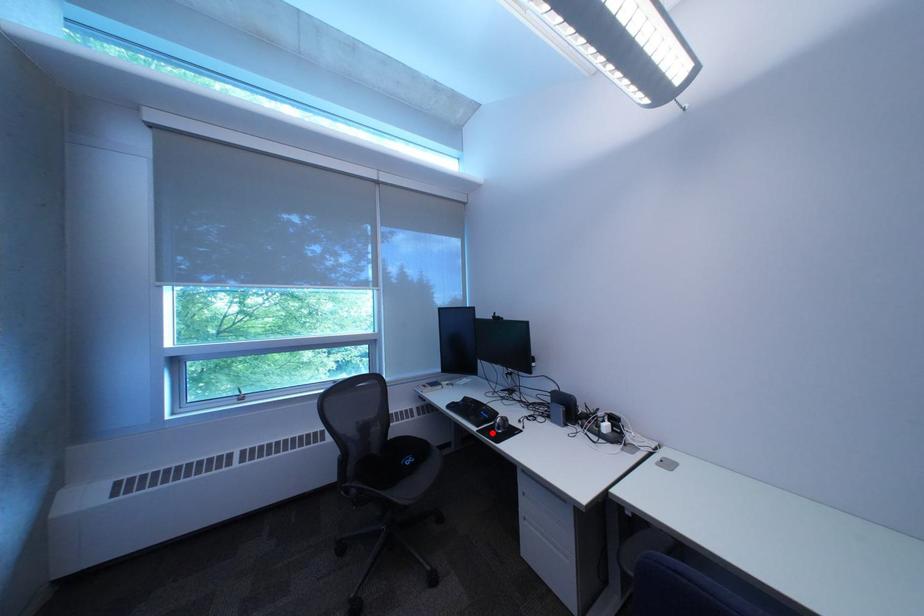
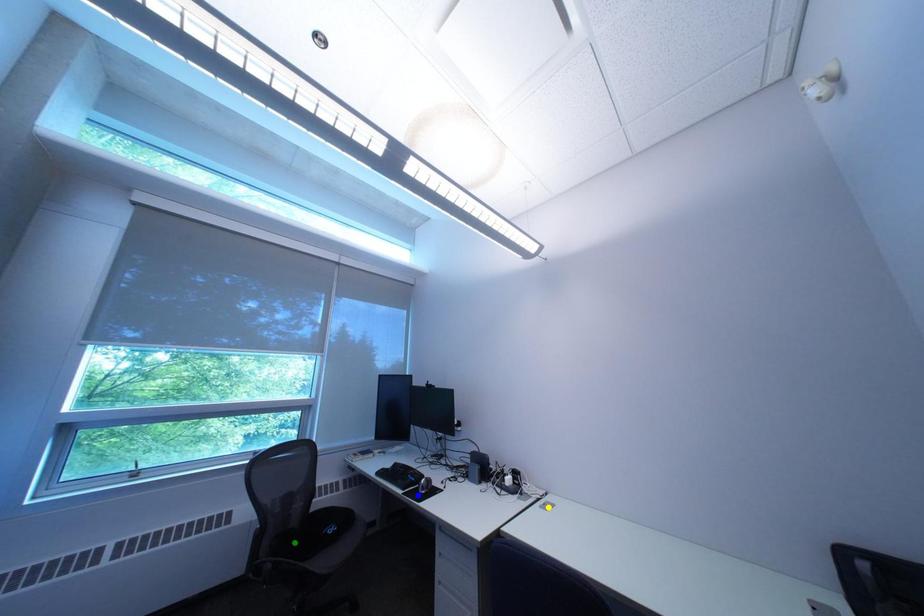
Question: I am providing you with two images of the same scene from different viewpoints. A red point is marked on the first image. You are given multiple points on the second image. Which point in image 2 is actually the same real-world point as the red point in image 1?

Choices:
 (A) yellow point
 (B) green point
 (C) blue point

Answer: (C)